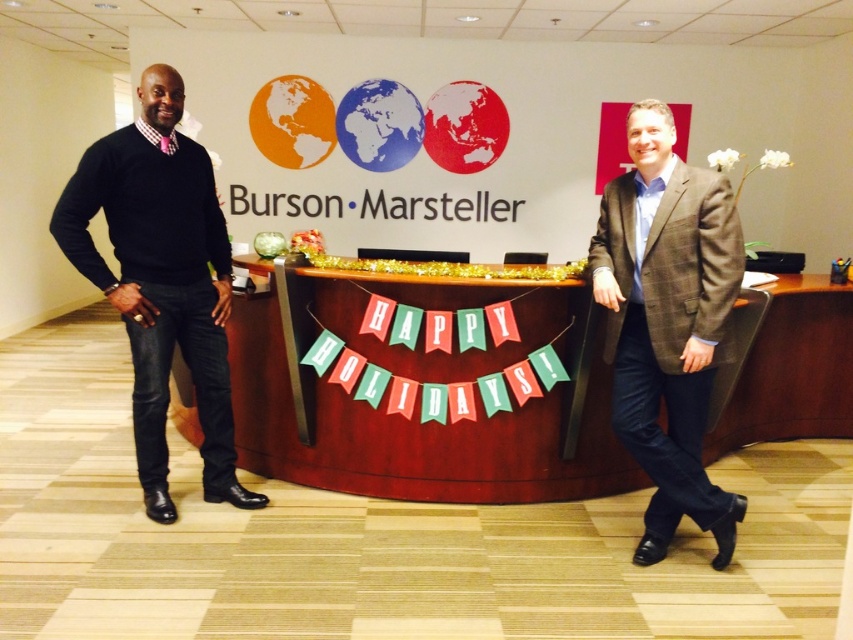
You are standing at the origin point in the office scene. The red wood desk at center is at point (416, 400). If you want to walk to the desk, in which direction should you move?

The red wood desk at center is located at point (416, 400). Since you are at the origin, you should move towards the coordinates (416, 400). This means moving right and forward in the scene to reach the desk.

You are navigating through the office and need to reach a document located at point (x=161, y=273). There is an obstacle at point (x=676, y=200). Will you be able to move around the obstacle to reach your destination?

Point (x=676, y=200) is in front of point (x=161, y=273), so you will encounter the obstacle first and may need to navigate around it before reaching the destination.